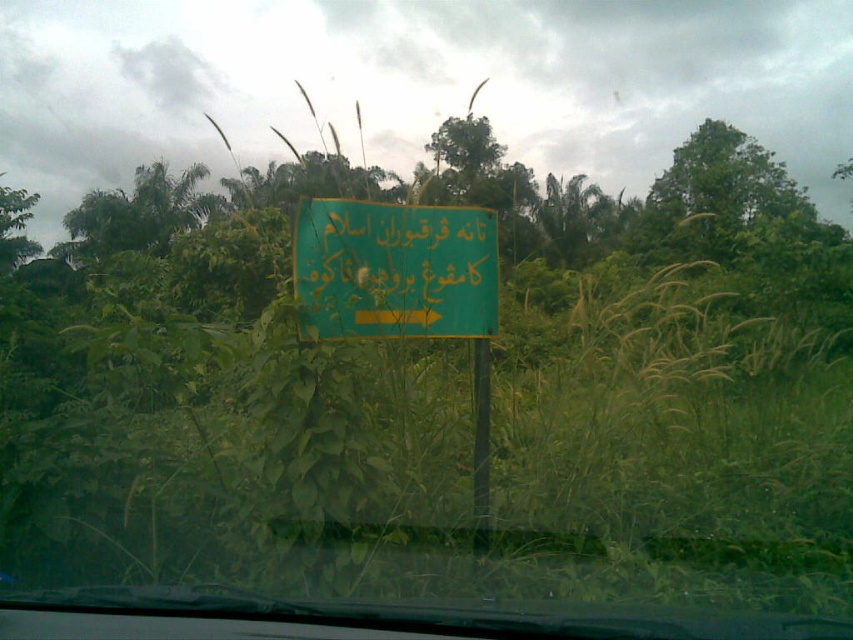
Is green leafy tree at upper right taller than green plastic pole at center?

Correct, green leafy tree at upper right is much taller as green plastic pole at center.

Is point (651, 224) farther from camera compared to point (474, 506)?

Yes, point (651, 224) is farther from viewer.

You are a GUI agent. You are given a task and a screenshot of the screen. Output one action in this format:
    pyautogui.click(x=<x>, y=<y>)
    Task: Click on the green leafy tree at upper right
    The width and height of the screenshot is (853, 640).
    Given the screenshot: What is the action you would take?
    pyautogui.click(x=721, y=196)

Does green matte sign at center have a greater height compared to green leafy tree at upper right?

In fact, green matte sign at center may be shorter than green leafy tree at upper right.

The width and height of the screenshot is (853, 640). Describe the element at coordinates (393, 269) in the screenshot. I see `green matte sign at center` at that location.

Between point (325, 216) and point (766, 211), which one is positioned in front?

Point (325, 216) is more forward.

Locate an element on the screen. Image resolution: width=853 pixels, height=640 pixels. green matte sign at center is located at coordinates (393, 269).

Which is more to the right, green matte sign at center or green plastic pole at center?

green plastic pole at center

Is point (297, 266) positioned in front of point (486, 340)?

Yes, point (297, 266) is closer to viewer.

Image resolution: width=853 pixels, height=640 pixels. In order to click on green matte sign at center in this screenshot , I will do `click(393, 269)`.